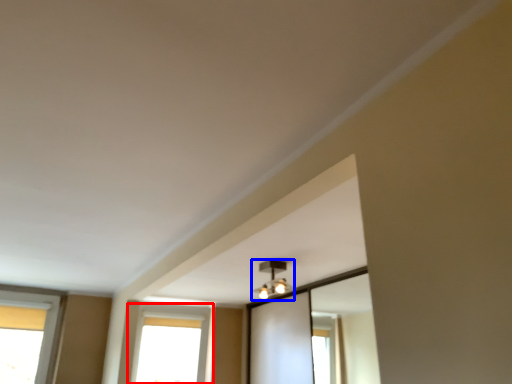
Question: Among these objects, which one is farthest to the camera, window (highlighted by a red box) or light fixture (highlighted by a blue box)?

Choices:
 (A) window
 (B) light fixture

Answer: (A)